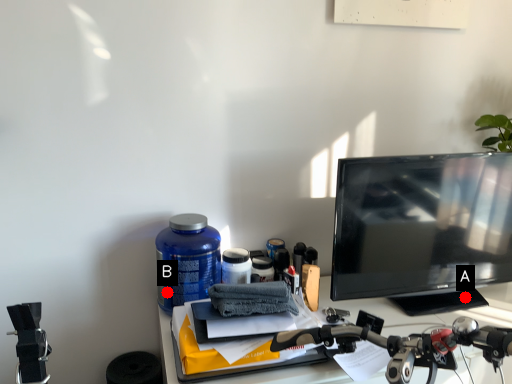
Question: Two points are circled on the image, labeled by A and B beside each circle. Which point is closer to the camera?

Choices:
 (A) A is closer
 (B) B is closer

Answer: (B)